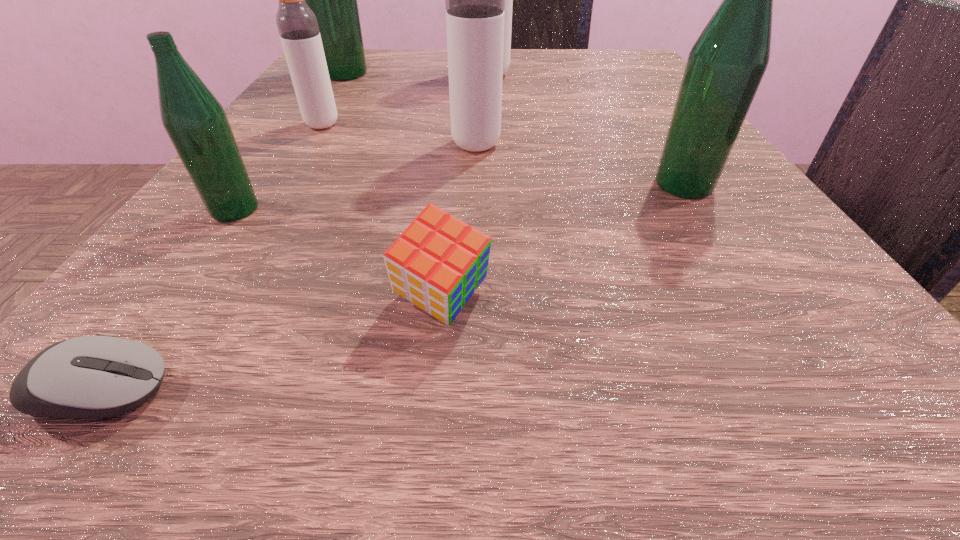
You are a GUI agent. You are given a task and a screenshot of the screen. Output one action in this format:
    pyautogui.click(x=<x>, y=<y>)
    Task: Click on the farthest green bottle
    
    Given the screenshot: What is the action you would take?
    pyautogui.click(x=333, y=0)

Locate an element on the screen. the farthest gray bottle is located at coordinates coord(508,0).

This screenshot has width=960, height=540. What are the coordinates of `the second smallest gray bottle` in the screenshot? It's located at (474, 0).

Find the location of `the nearest gray bottle`. the nearest gray bottle is located at coordinates (474, 0).

The height and width of the screenshot is (540, 960). Identify the location of the second smallest green bottle. (725, 66).

Locate an element on the screen. the rightmost green bottle is located at coordinates (725, 66).

Locate an element on the screen. This screenshot has height=540, width=960. the leftmost gray bottle is located at coordinates (298, 28).

Identify the location of the second nearest gray bottle. The height and width of the screenshot is (540, 960). (298, 28).

At what (x,y) coordinates should I click in order to perform the action: click on the smallest green bottle. Please return your answer as a coordinate pair (x, y). This screenshot has width=960, height=540. Looking at the image, I should click on (195, 121).

Identify the location of the seventh tallest object. The width and height of the screenshot is (960, 540). (437, 263).